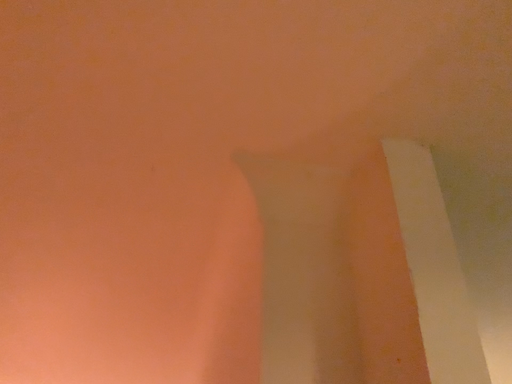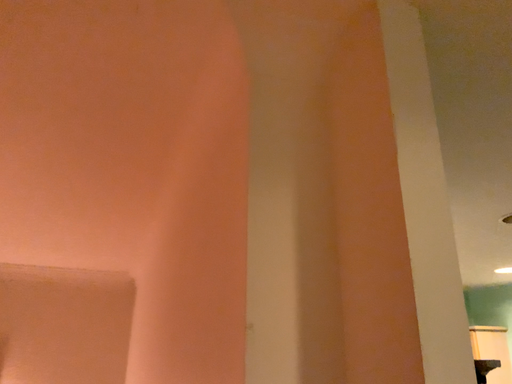
Question: Which way did the camera rotate in the video?

Choices:
 (A) rotated right
 (B) rotated left

Answer: (A)